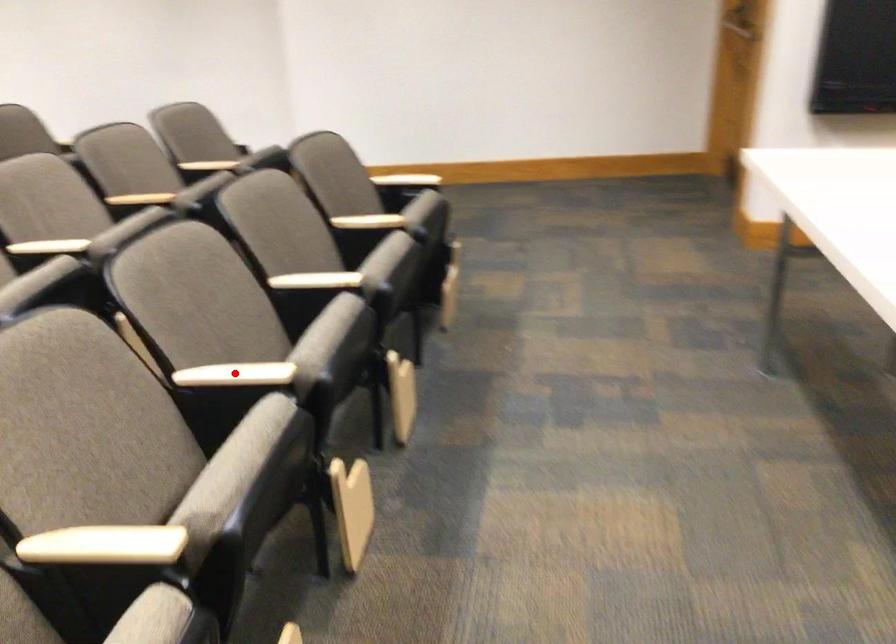
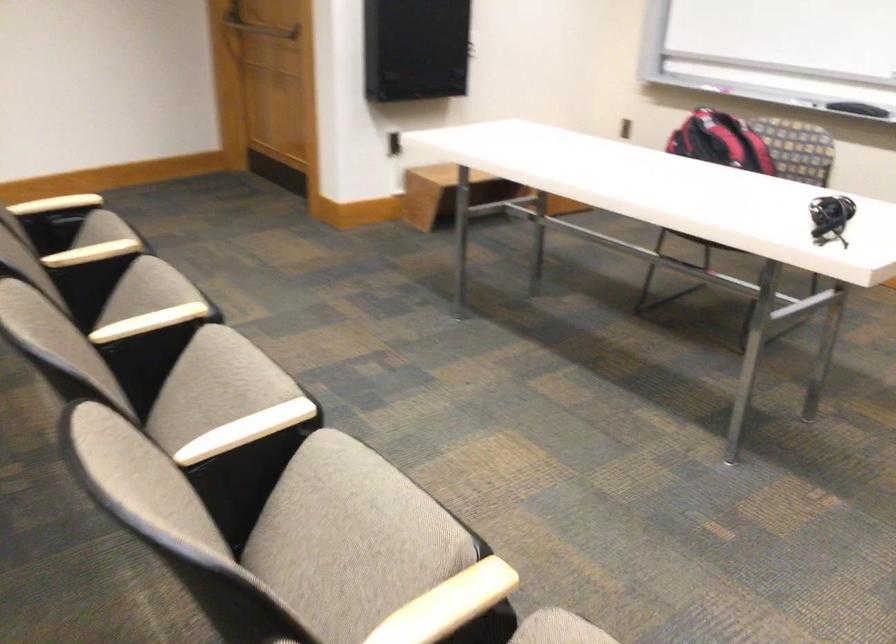
Question: I am providing you with two images of the same scene from different viewpoints. A red point is shown in image1. For the corresponding object point in image2, is it positioned nearer or farther from the camera?

Choices:
 (A) Nearer
 (B) Farther

Answer: (A)